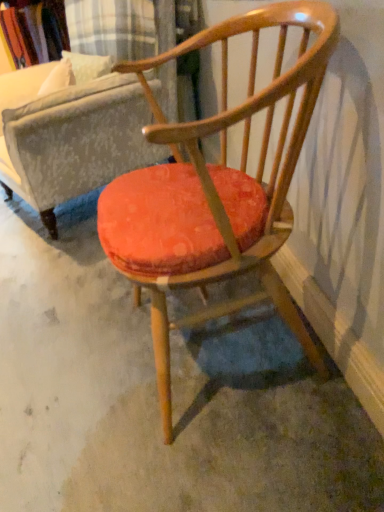
Question: In the image, is wooden armchair at center positioned in front of or behind velvet orange cushion at center?

Choices:
 (A) front
 (B) behind

Answer: (A)

Question: From a real-world perspective, is wooden armchair at center positioned above or below velvet orange cushion at center?

Choices:
 (A) above
 (B) below

Answer: (B)

Question: Which object is positioned farthest from the wooden armchair at center?

Choices:
 (A) velvet orange cushion at center
 (B) orange fabric cushion at center

Answer: (A)

Question: Estimate the real-world distances between objects in this image. Which object is farther from the orange fabric cushion at center?

Choices:
 (A) velvet orange cushion at center
 (B) wooden armchair at center

Answer: (A)